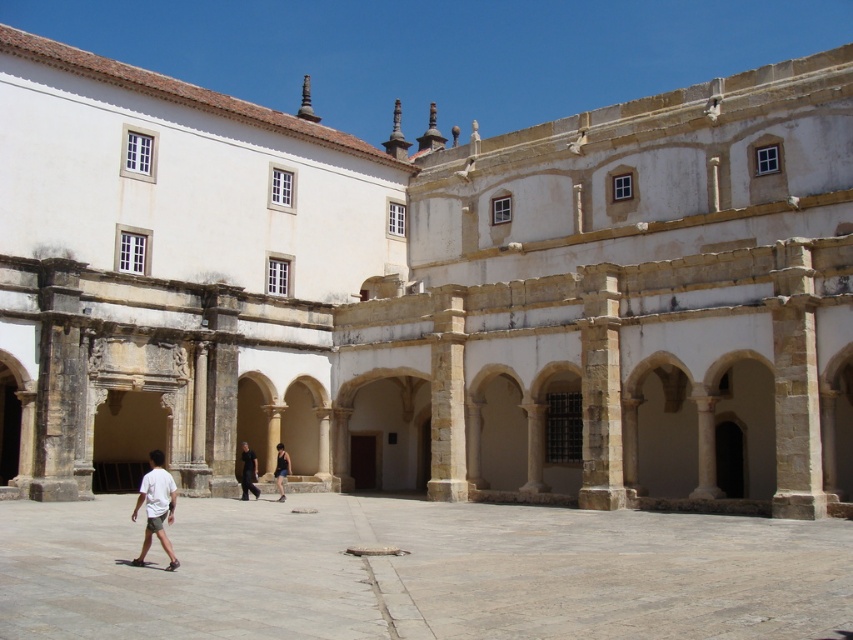
You are standing in the courtyard and want to place your white cotton shirt at lower left on the smooth stone courtyard at center. Will the shirt fit entirely on the courtyard?

The smooth stone courtyard at center is bigger than the white cotton shirt at lower left, so yes, the shirt will fit entirely on the courtyard.

You are standing in the courtyard and notice a white cotton shirt at lower left and dark blue denim shorts at center. Which item is positioned higher relative to the other?

The white cotton shirt at lower left is above the dark blue denim shorts at center, so it is positioned higher.

You are standing in the courtyard and want to walk from the white cotton shirt at lower left to the smooth stone courtyard at center. Which direction should you move?

You should move to the right to reach the smooth stone courtyard at center from the white cotton shirt at lower left since the smooth stone courtyard at center is located to the right of the white cotton shirt at lower left.